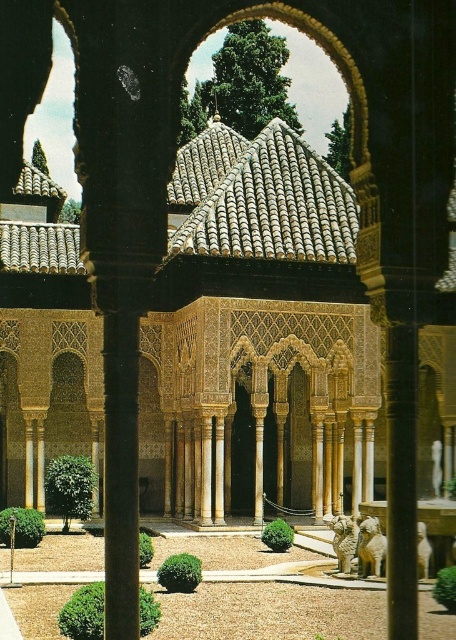
Looking at this image, you are a tourist standing at the entrance of the Alhambra and notice the brown textured gravel at center and the white marble column at center. Which object is positioned to the left of the other?

The brown textured gravel at center is to the left of white marble column at center.

Based on the photo, you are standing in the Alhambra palace and want to take a photo of the central structure with the tall, slender columns. The camera you are using has a maximum focus range of 150 feet. Will the camera be able to focus on the point at coordinates point (187,614)?

The point (187,614) is 150.61 feet from the camera, which exceeds the maximum focus range of 150 feet. Therefore, the camera will not be able to focus on the point at coordinates point (187,614).

You are an architect designing a new garden pathway. You have two materials available from the Alhambra scene you observed. The brown textured gravel at center and the white marble column at center. Which material would be more suitable for creating a stable base for a small statue, and why?

The white marble column at center is more suitable for a stable base because it has a smaller size compared to the brown textured gravel at center, providing a firmer and more level surface.